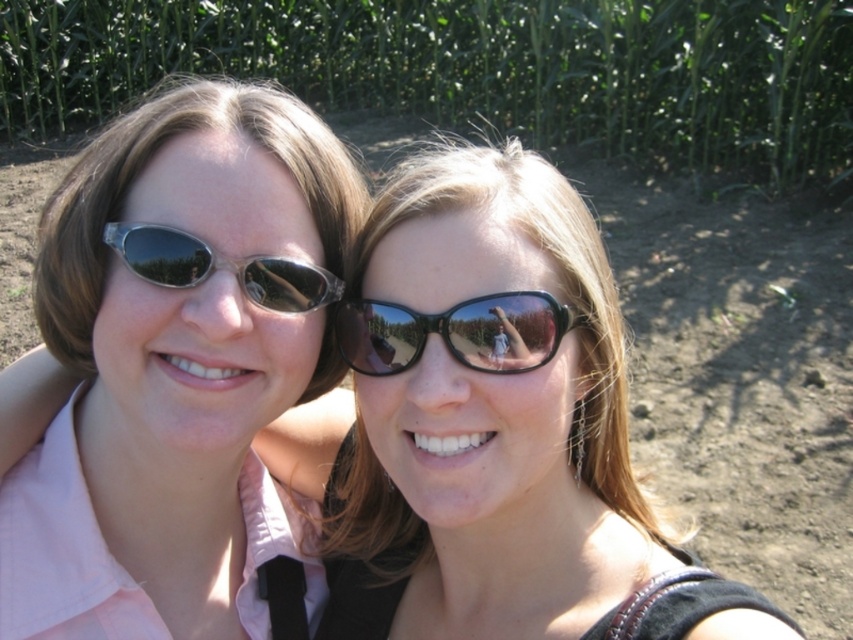
Question: Does matte pink shirt at left appear on the left side of green leafy corn at upper center?

Choices:
 (A) no
 (B) yes

Answer: (B)

Question: Which point is closer to the camera?

Choices:
 (A) matte pink shirt at left
 (B) black glossy sunglasses at center
 (C) matte black sunglasses at left
 (D) green leafy corn at upper center

Answer: (A)

Question: In this image, where is matte pink shirt at left located relative to green leafy corn at upper center?

Choices:
 (A) above
 (B) below

Answer: (B)

Question: Which is farther from the matte black sunglasses at left?

Choices:
 (A) matte pink shirt at left
 (B) green leafy corn at upper center

Answer: (B)

Question: Is green leafy corn at upper center to the left of black glossy sunglasses at center from the viewer's perspective?

Choices:
 (A) no
 (B) yes

Answer: (A)

Question: Which object is closer to the camera taking this photo?

Choices:
 (A) green leafy corn at upper center
 (B) matte black sunglasses at left
 (C) matte pink shirt at left

Answer: (C)